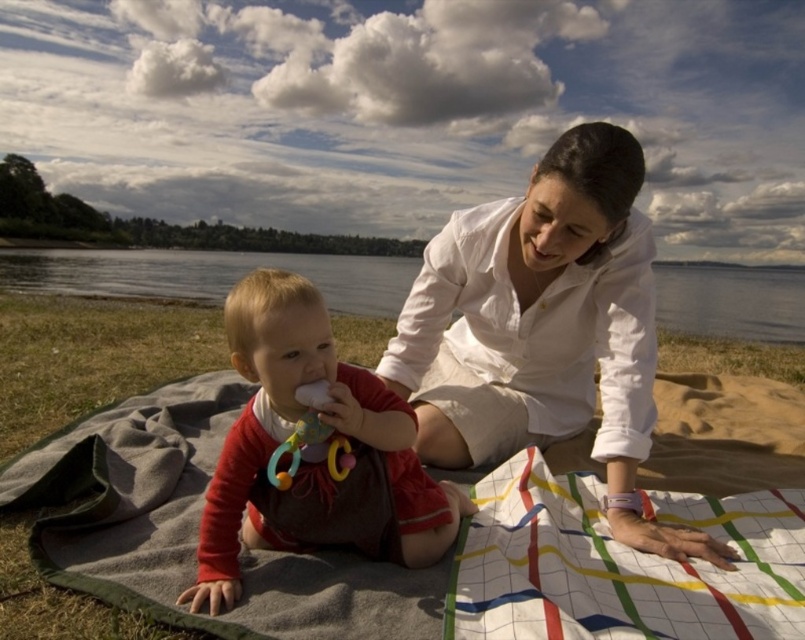
You are a photographer trying to capture the scene. You want to ensure the white cotton shirt at upper center and the clear water at center are both in focus. Which object should you position your camera focus closer to?

You should position your camera focus closer to the clear water at center because the white cotton shirt at upper center is to the right of the clear water at center, meaning it is farther away from the camera. Focusing on the closer object ensures both are in focus using the hyperfocal distance technique.

You are planning to lay out a picnic setup and have both the white woven blanket at center and the white cotton shirt at upper center. Which item should you choose if you need more space for snacks and drinks?

The white woven blanket at center has a larger size compared to the white cotton shirt at upper center, so you should choose the white woven blanket at center for more space.